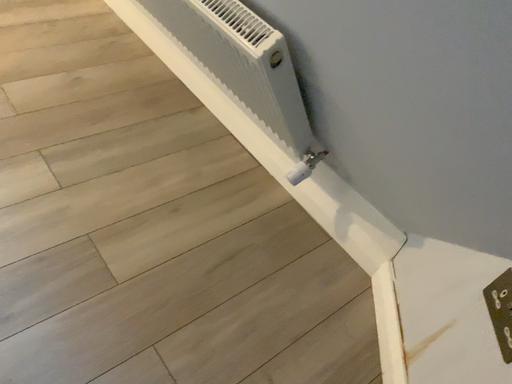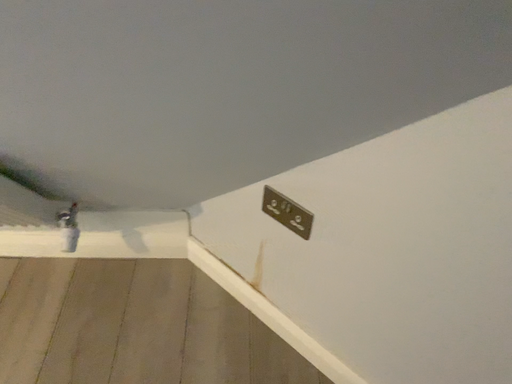
Question: Which way did the camera rotate in the video?

Choices:
 (A) rotated downward
 (B) rotated upward

Answer: (B)